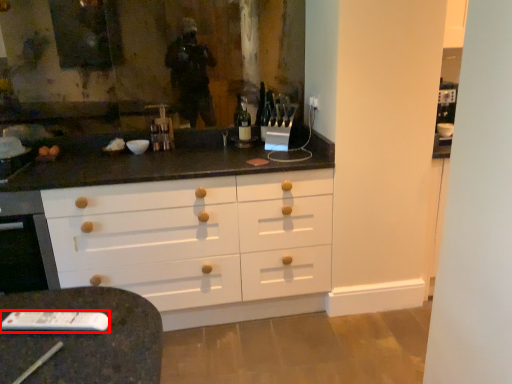
Question: Where is remote (annotated by the red box) located in relation to bottle in the image?

Choices:
 (A) left
 (B) right

Answer: (A)